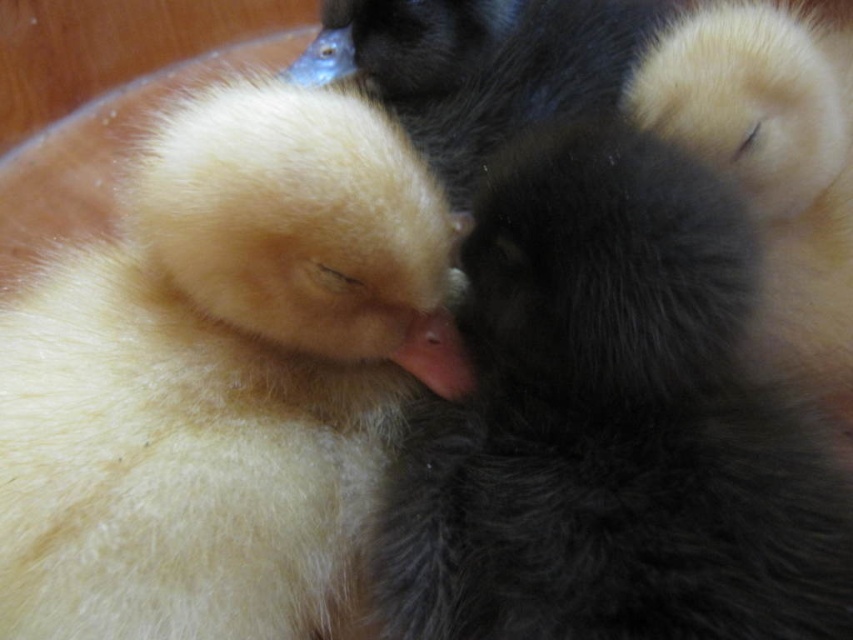
Question: Among these points, which one is nearest to the camera?

Choices:
 (A) (757, 10)
 (B) (381, 4)
 (C) (277, 364)

Answer: (C)

Question: Can you confirm if black fluffy cat at center is positioned below black fuzzy duck at center?

Choices:
 (A) no
 (B) yes

Answer: (B)

Question: Which object is farther from the camera taking this photo?

Choices:
 (A) black fuzzy duck at center
 (B) soft yellow duckling at left
 (C) fluffy yellow duckling at upper right
 (D) black fluffy cat at center

Answer: (A)

Question: Estimate the real-world distances between objects in this image. Which object is farther from the fluffy yellow duckling at upper right?

Choices:
 (A) black fluffy cat at center
 (B) black fuzzy duck at center
 (C) soft yellow duckling at left

Answer: (C)

Question: Is soft yellow duckling at left positioned behind fluffy yellow duckling at upper right?

Choices:
 (A) no
 (B) yes

Answer: (A)

Question: From the image, what is the correct spatial relationship of soft yellow duckling at left in relation to black fuzzy duck at center?

Choices:
 (A) below
 (B) above

Answer: (A)